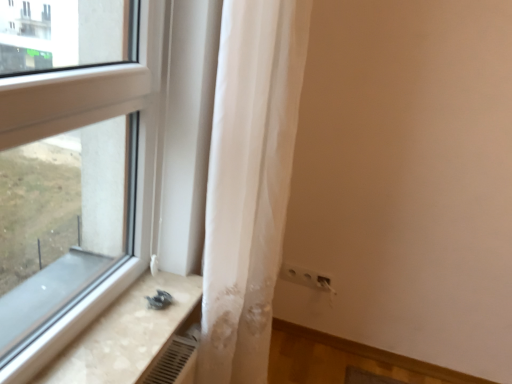
Where is `free spot above beige marble counter top at lower left (from a real-world perspective)`? The width and height of the screenshot is (512, 384). free spot above beige marble counter top at lower left (from a real-world perspective) is located at coordinates (131, 321).